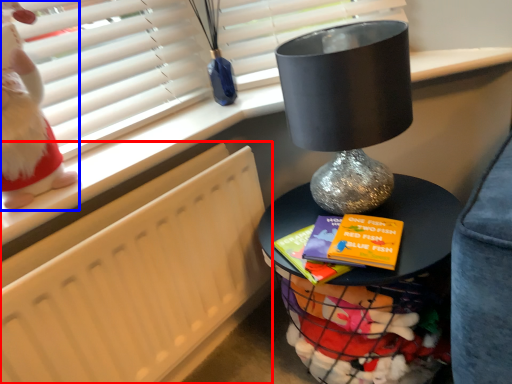
Question: Among these objects, which one is farthest to the camera, radiator (highlighted by a red box) or doll (highlighted by a blue box)?

Choices:
 (A) radiator
 (B) doll

Answer: (A)